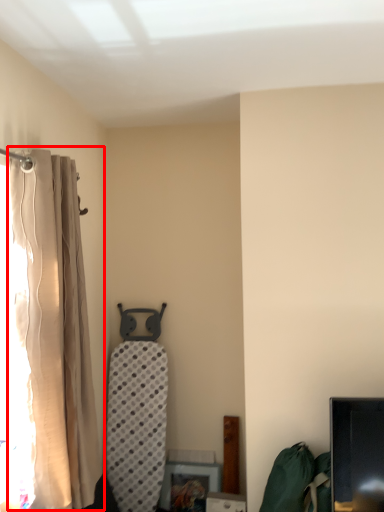
Question: From the image's perspective, what is the correct spatial positioning of curtain (annotated by the red box) in reference to bean bag chair?

Choices:
 (A) above
 (B) below

Answer: (A)